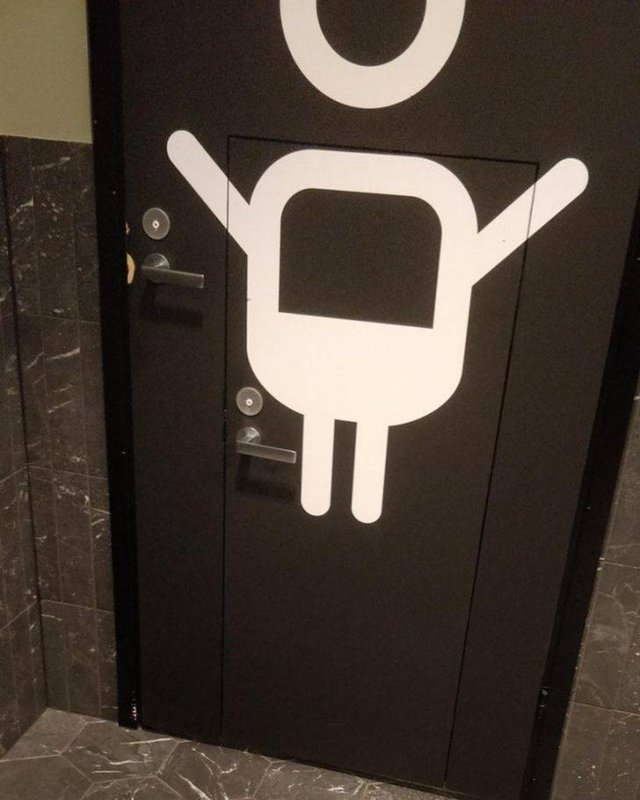
Identify the location of door. The width and height of the screenshot is (640, 800). (460, 578).